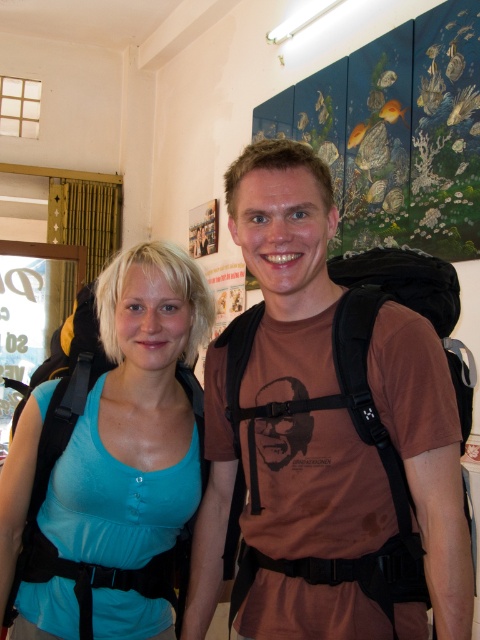
Question: Is brown matte t-shirt at center positioned before teal fabric tank top at center?

Choices:
 (A) yes
 (B) no

Answer: (A)

Question: Is brown matte t-shirt at center below teal fabric tank top at center?

Choices:
 (A) yes
 (B) no

Answer: (B)

Question: Which object appears closest to the camera in this image?

Choices:
 (A) brown matte t-shirt at center
 (B) teal fabric tank top at center

Answer: (A)

Question: Can you confirm if brown matte t-shirt at center is thinner than teal fabric tank top at center?

Choices:
 (A) no
 (B) yes

Answer: (A)